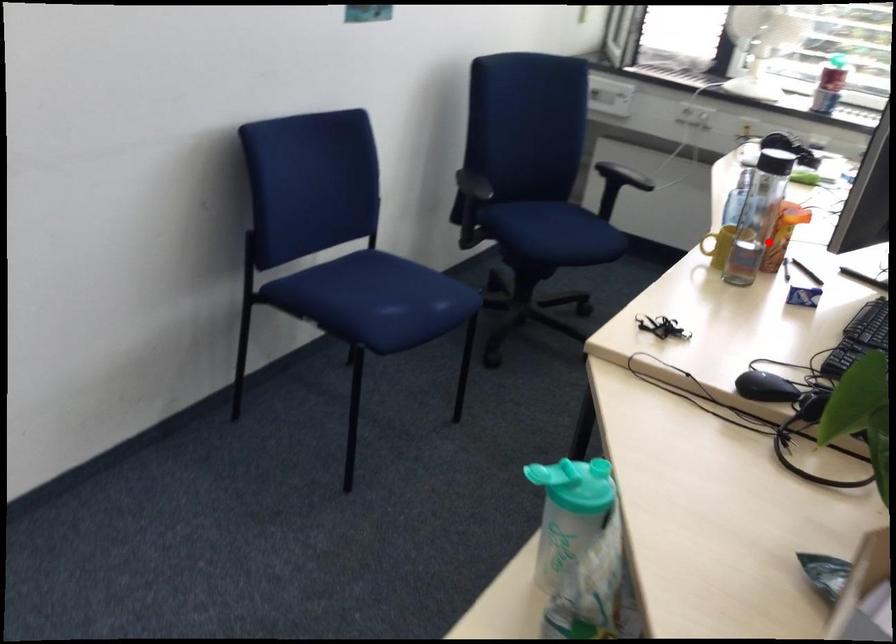
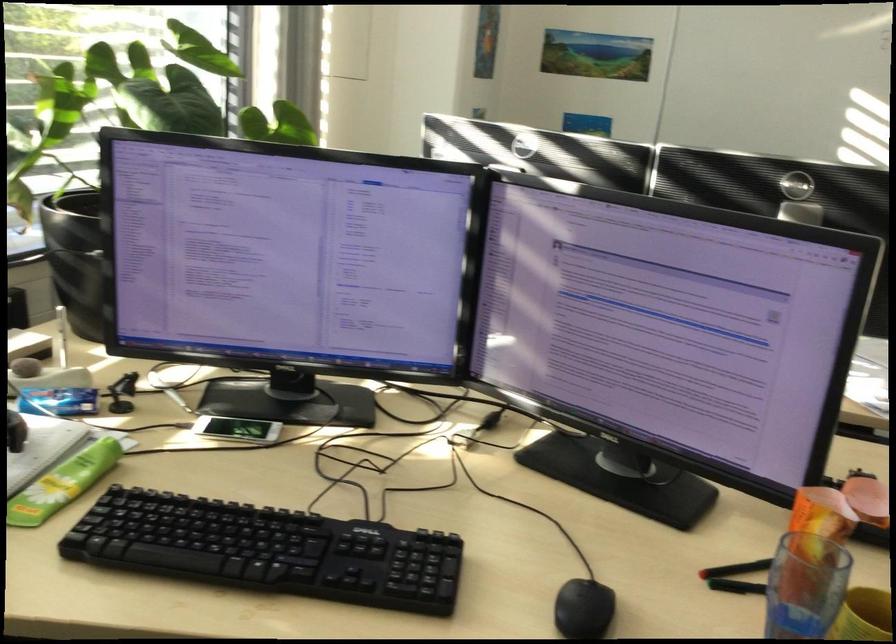
Question: I am providing you with two images of the same scene from different viewpoints. Image1 has a red point marked. In image2, the corresponding 3D location appears at what relative position? Reply with the corresponding letter.

Choices:
 (A) Closer
 (B) Farther

Answer: (A)